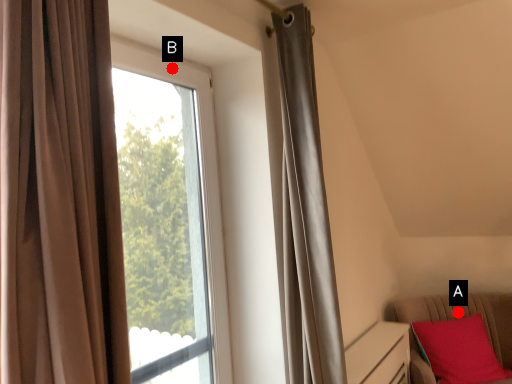
Question: Two points are circled on the image, labeled by A and B beside each circle. Which point is farther to the camera?

Choices:
 (A) A is further
 (B) B is further

Answer: (A)